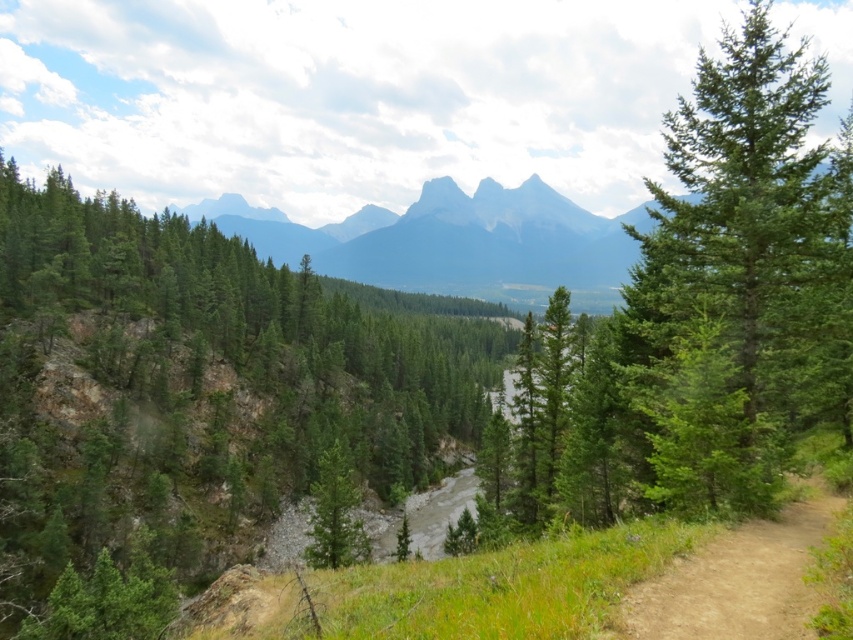
Is gray rocky mountain at center below brown dirt track at lower right?

No, gray rocky mountain at center is not below brown dirt track at lower right.

Between gray rocky mountain at center and brown dirt track at lower right, which one appears on the left side from the viewer's perspective?

From the viewer's perspective, brown dirt track at lower right appears more on the left side.

What do you see at coordinates (454, 243) in the screenshot?
I see `gray rocky mountain at center` at bounding box center [454, 243].

The height and width of the screenshot is (640, 853). I want to click on gray rocky mountain at center, so click(454, 243).

Which is behind, point (703, 486) or point (402, 237)?

Positioned behind is point (402, 237).

Which is above, green evergreen tree at right or gray rocky mountain at center?

green evergreen tree at right is above.

Where is `green evergreen tree at right`? green evergreen tree at right is located at coordinates (740, 275).

Does green evergreen tree at right have a greater width compared to green matte tree at center?

Indeed, green evergreen tree at right has a greater width compared to green matte tree at center.

What do you see at coordinates (740, 275) in the screenshot? I see `green evergreen tree at right` at bounding box center [740, 275].

Who is more distant from viewer, (746,58) or (352,488)?

Point (352,488)

You are a GUI agent. You are given a task and a screenshot of the screen. Output one action in this format:
    pyautogui.click(x=<x>, y=<y>)
    Task: Click on the green evergreen tree at right
    The width and height of the screenshot is (853, 640).
    Given the screenshot: What is the action you would take?
    pyautogui.click(x=740, y=275)